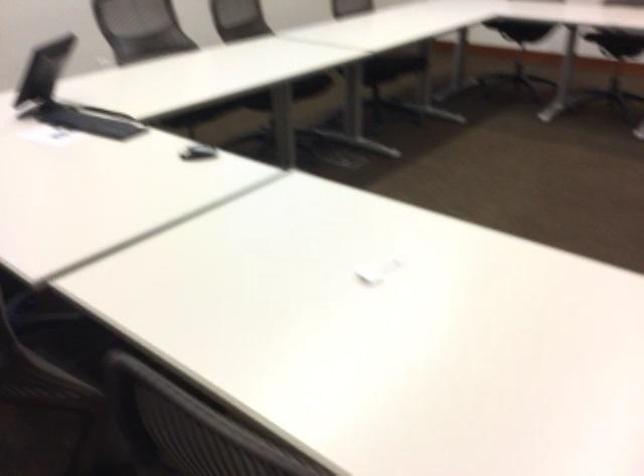
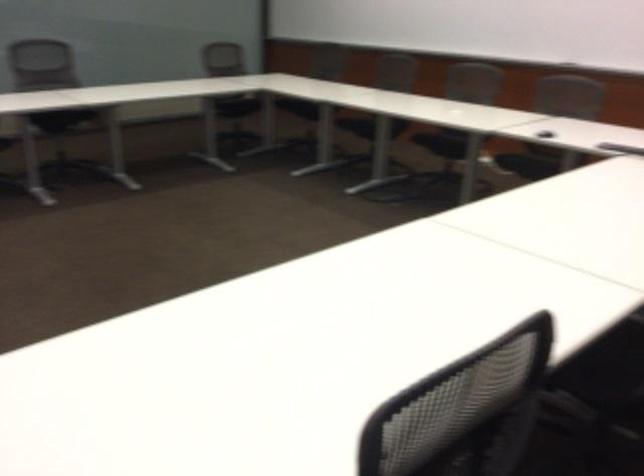
First-person continuous shooting, in which direction is the camera rotating?

The camera's rotation is toward right-down.